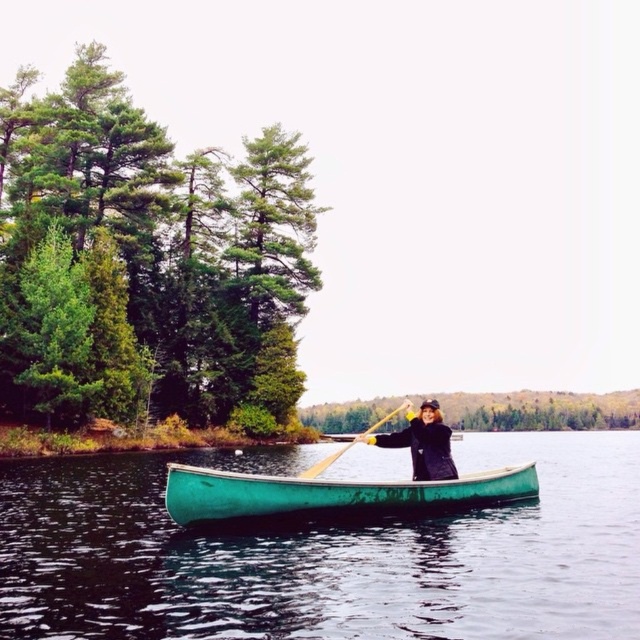
Describe the element at coordinates (330, 496) in the screenshot. The height and width of the screenshot is (640, 640). I see `green polished wood canoe at center` at that location.

What do you see at coordinates (330, 496) in the screenshot? This screenshot has width=640, height=640. I see `green polished wood canoe at center` at bounding box center [330, 496].

Locate an element on the screen. The image size is (640, 640). green polished wood canoe at center is located at coordinates (330, 496).

Does green polished wood canoe at center have a greater width compared to black matte jacket at center?

In fact, green polished wood canoe at center might be narrower than black matte jacket at center.

You are a GUI agent. You are given a task and a screenshot of the screen. Output one action in this format:
    pyautogui.click(x=<x>, y=<y>)
    Task: Click on the green polished wood canoe at center
    Image resolution: width=640 pixels, height=640 pixels.
    Given the screenshot: What is the action you would take?
    pyautogui.click(x=330, y=496)

The height and width of the screenshot is (640, 640). Find the location of `green polished wood canoe at center`. green polished wood canoe at center is located at coordinates (330, 496).

Does green smooth water at center appear under black matte jacket at center?

Correct, green smooth water at center is located below black matte jacket at center.

Does point (307, 596) lie in front of point (378, 435)?

Yes.

Locate an element on the screen. The image size is (640, 640). green smooth water at center is located at coordinates (324, 554).